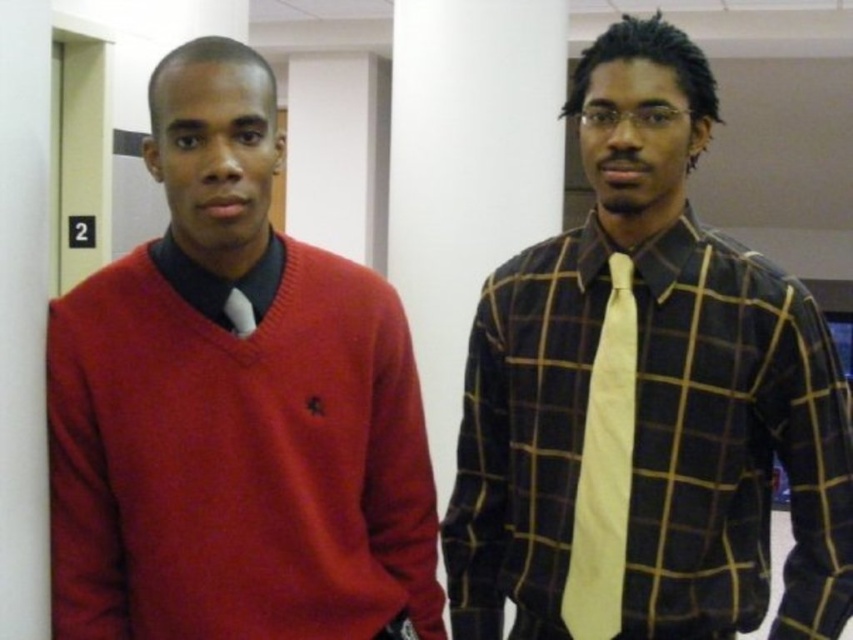
You are standing in a hallway and want to greet both people in the image. If you start facing the matte red sweater at left, which direction should you turn to first reach the plaid cotton shirt at center?

Since the plaid cotton shirt at center is positioned on the right side of the matte red sweater at left, you should turn to your right to face the plaid cotton shirt at center first.

You are a photographer setting up for a group photo. You need to position two subjects so that there is at least 50 centimeters between them for proper lighting. Given the current distance between the matte red sweater at left and the yellow silk tie at right, can they stay in their current positions?

The matte red sweater at left is currently 40.39 centimeters away from the yellow silk tie at right, which is less than the required 50 centimeters. Therefore, they need to move further apart to meet the lighting requirement.